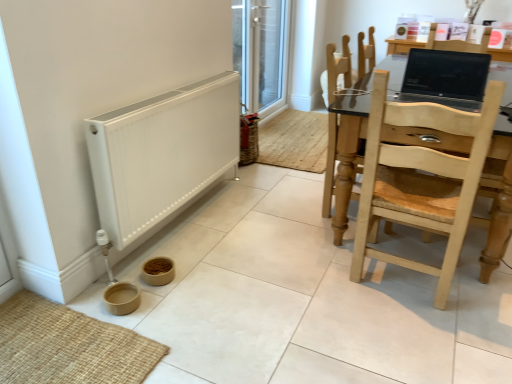
The width and height of the screenshot is (512, 384). In order to click on vacant space situated on the left part of light wood chair at right, the first chair in the front-to-back sequence in this screenshot , I will do `click(318, 278)`.